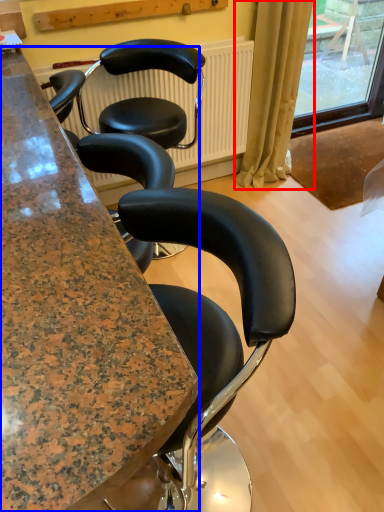
Question: Which of the following is the closest to the observer, curtain (highlighted by a red box) or cabinetry (highlighted by a blue box)?

Choices:
 (A) curtain
 (B) cabinetry

Answer: (B)